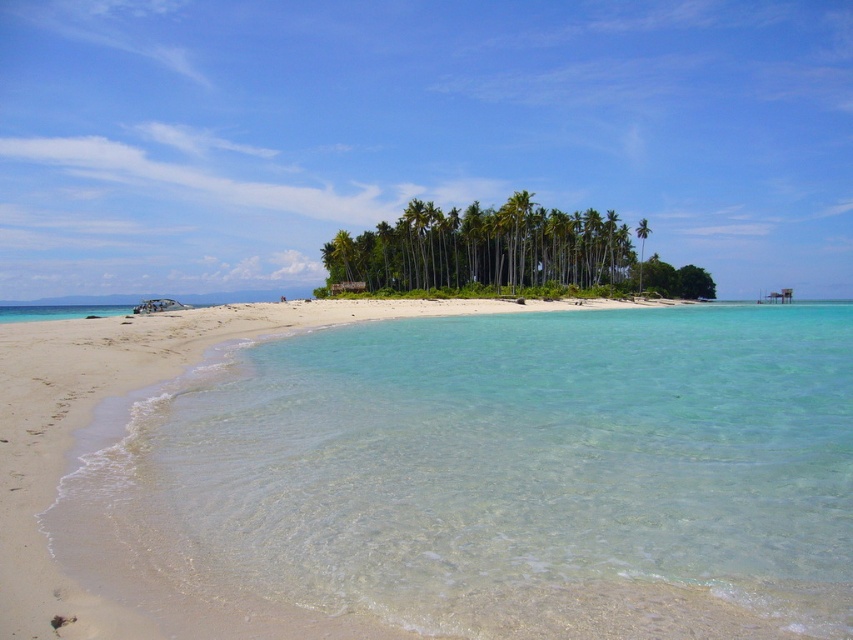
Is light beige sand at lower left above green leafy palm tree at center?

Actually, light beige sand at lower left is below green leafy palm tree at center.

Which of these two, light beige sand at lower left or green leafy palm tree at center, stands shorter?

With less height is light beige sand at lower left.

Who is more forward, (103, 364) or (640, 262)?

Positioned in front is point (103, 364).

Where is `light beige sand at lower left`? light beige sand at lower left is located at coordinates (122, 396).

Does light beige sand at lower left appear under green leafy palm trees at center?

Yes.

Does light beige sand at lower left have a greater height compared to green leafy palm trees at center?

In fact, light beige sand at lower left may be shorter than green leafy palm trees at center.

Does point (102, 620) come closer to viewer compared to point (428, 214)?

Yes, it is.

Find the location of `light beige sand at lower left`. light beige sand at lower left is located at coordinates (122, 396).

Which is above, green leafy palm trees at center or green leafy palm tree at center?

green leafy palm tree at center

Does green leafy palm trees at center appear over green leafy palm tree at center?

No, green leafy palm trees at center is not above green leafy palm tree at center.

Locate an element on the screen. The width and height of the screenshot is (853, 640). green leafy palm trees at center is located at coordinates (483, 248).

Locate an element on the screen. The height and width of the screenshot is (640, 853). green leafy palm trees at center is located at coordinates 483,248.